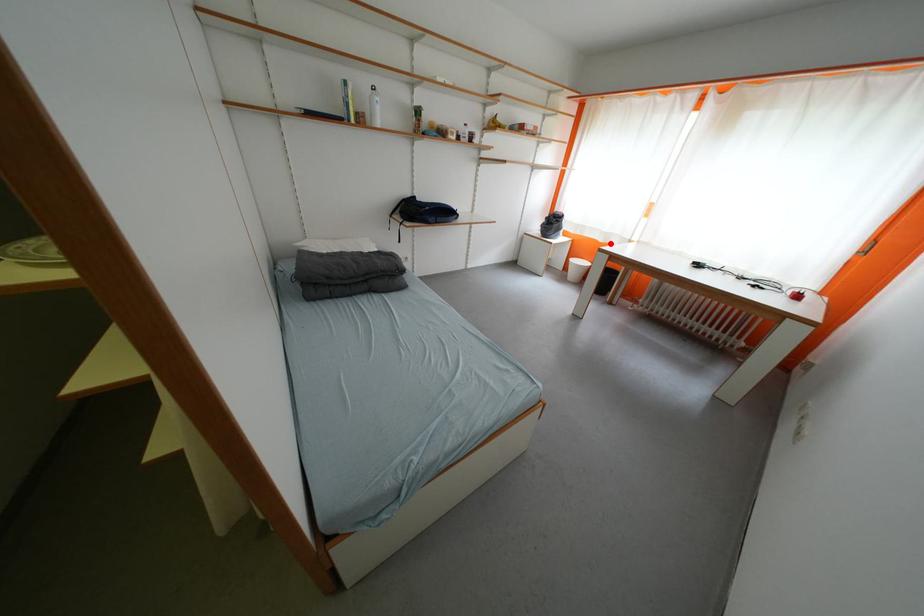
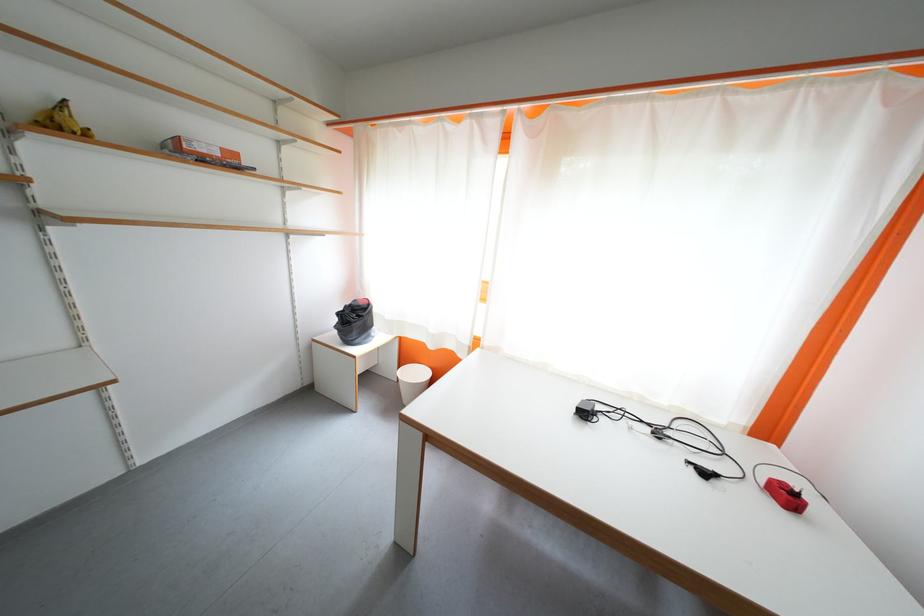
Find the pixel in the second image that matches the highlighted location in the first image.

(440, 350)